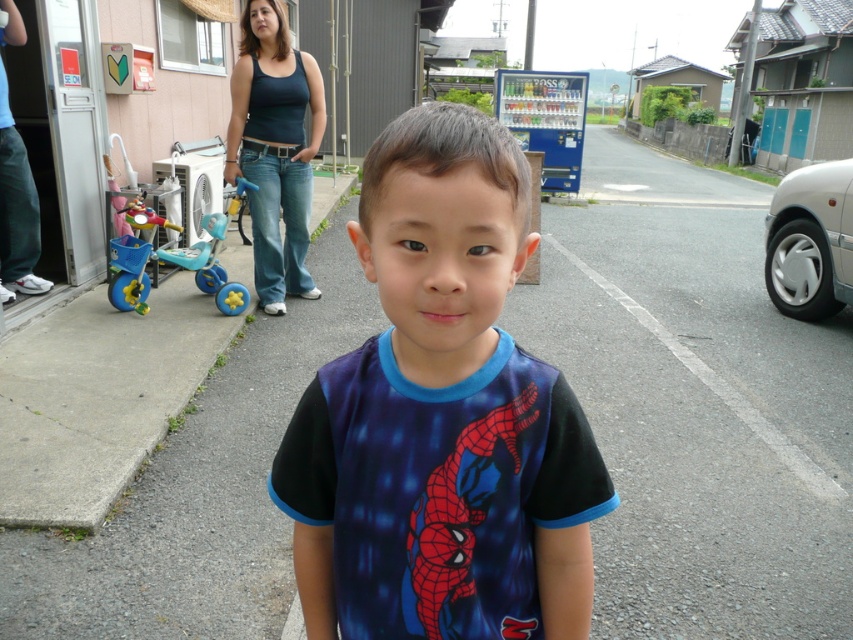
You are a delivery person trying to park your bike. You see the gray asphalt pavement at center and the black cotton tank top at upper center. Which surface can you park your bike on?

The gray asphalt pavement at center is the appropriate surface to park the bike because it is a solid ground, unlike the black cotton tank top at upper center which is a clothing item and cannot support the bike.